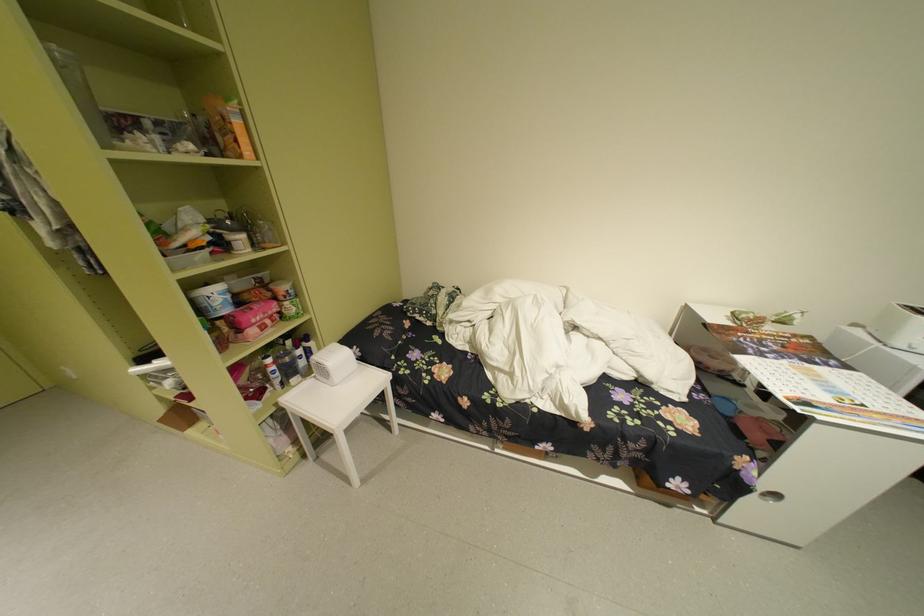
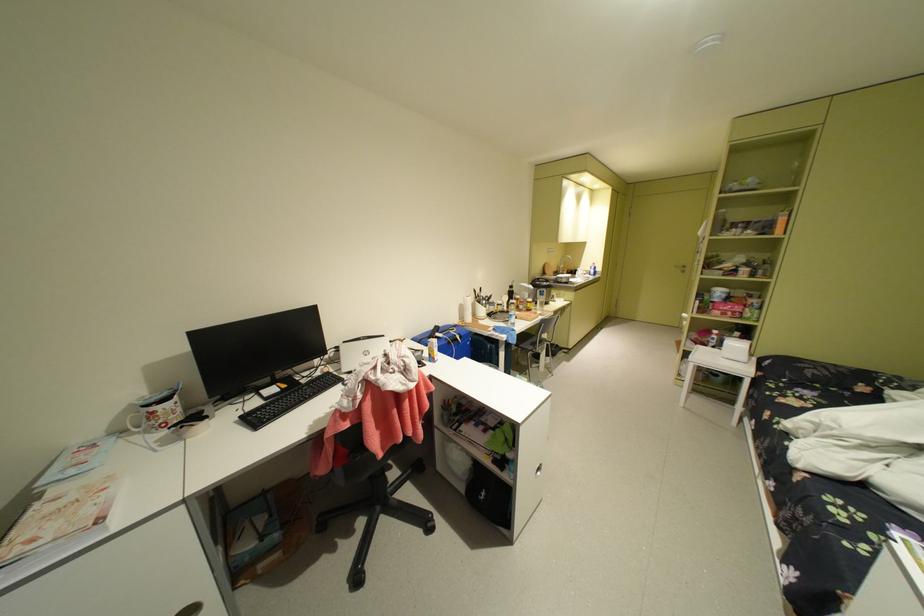
Find the pixel in the second image that matches [266,307] in the first image.

(740, 304)